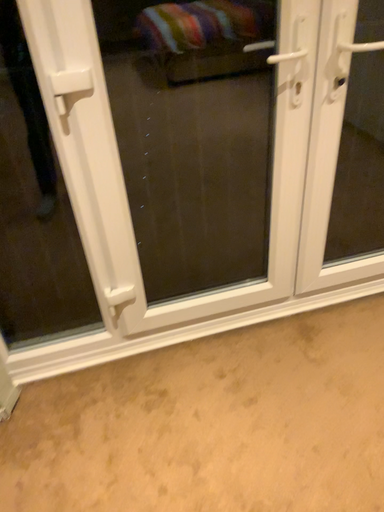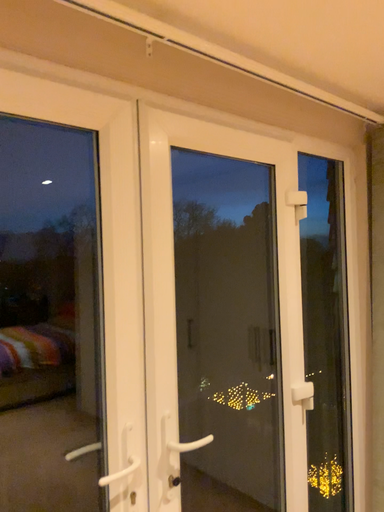
Question: How did the camera likely rotate when shooting the video?

Choices:
 (A) rotated left
 (B) rotated right

Answer: (B)